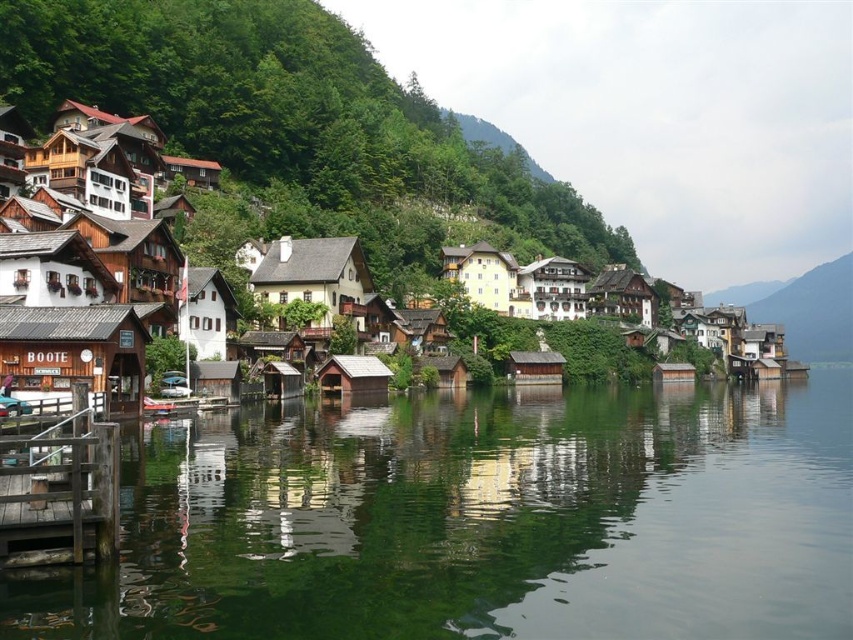
Question: Can you confirm if wooden dock at lower left is positioned above wooden cabin at center right?

Choices:
 (A) no
 (B) yes

Answer: (A)

Question: Which point is farther to the camera?

Choices:
 (A) (398, 397)
 (B) (809, 333)
 (C) (111, 464)

Answer: (B)

Question: Estimate the real-world distances between objects in this image. Which object is farther from the wooden houses at center?

Choices:
 (A) wooden dock at lower left
 (B) wooden cabin at center right
 (C) green reflective water at lower center

Answer: (B)

Question: Can you confirm if wooden houses at center is smaller than wooden dock at lower left?

Choices:
 (A) no
 (B) yes

Answer: (A)

Question: Which point is closer to the camera taking this photo?

Choices:
 (A) (57, 481)
 (B) (392, 456)
 (C) (258, 276)
 (D) (811, 292)

Answer: (A)

Question: Where is wooden houses at center located in relation to wooden cabin at center right in the image?

Choices:
 (A) right
 (B) left

Answer: (B)